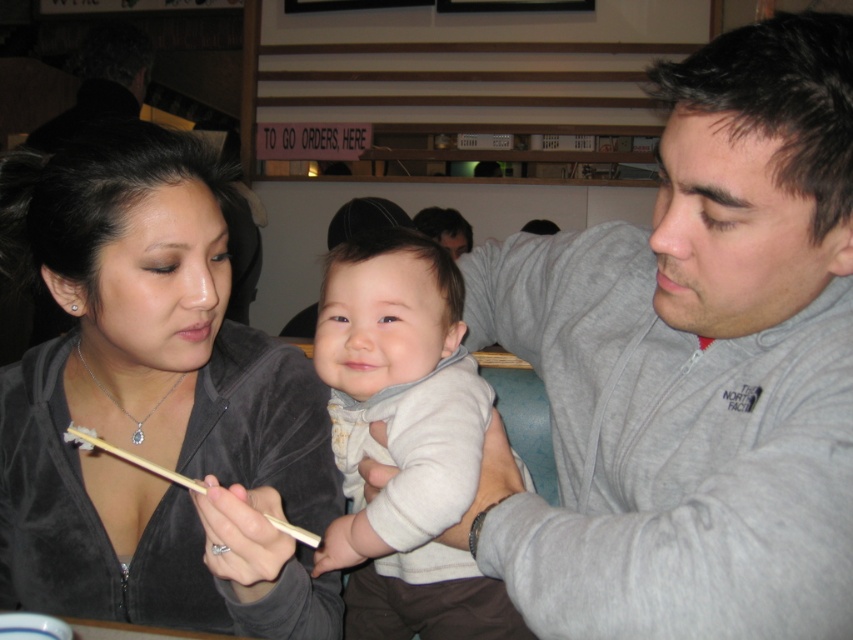
Question: Does light gray soft sweater at center appear over wooden chopsticks at lower center?

Choices:
 (A) no
 (B) yes

Answer: (A)

Question: Which point appears closest to the camera in this image?

Choices:
 (A) (753, 120)
 (B) (200, 614)
 (C) (107, 444)
 (D) (495, 596)

Answer: (A)

Question: Which of the following is the farthest from the observer?

Choices:
 (A) (267, 403)
 (B) (824, 378)
 (C) (317, 346)

Answer: (A)

Question: Does gray fleece jacket at upper right appear on the right side of light gray soft sweater at center?

Choices:
 (A) no
 (B) yes

Answer: (B)

Question: Is velvet gray hoodie at center thinner than light gray soft sweater at center?

Choices:
 (A) no
 (B) yes

Answer: (A)

Question: Which object appears farthest from the camera in this image?

Choices:
 (A) gray fleece jacket at upper right
 (B) light gray soft sweater at center

Answer: (B)